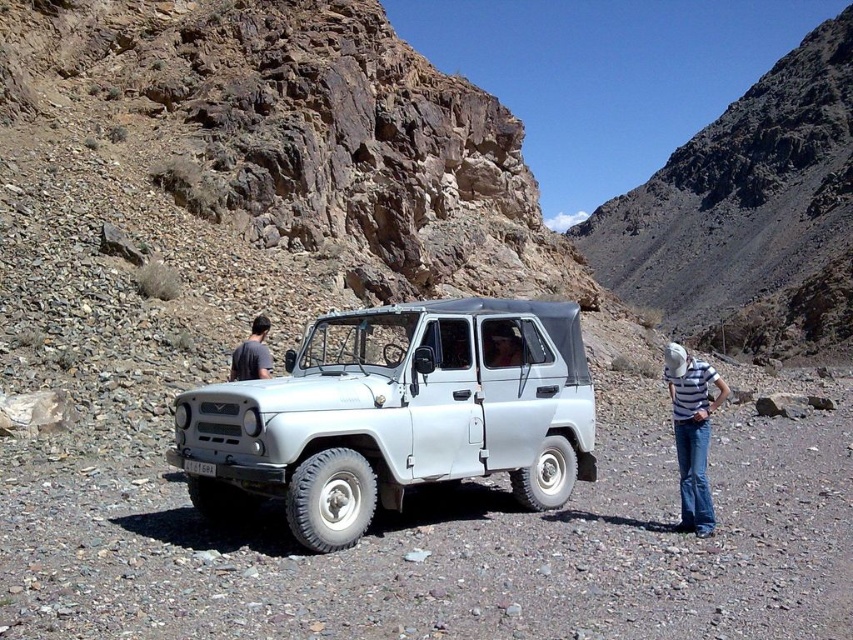
You are a photographer trying to capture both the matte gray vehicle at center and the gray cotton shirt at center in a single shot. Since the camera can only focus on objects within a specific size range, which object should you prioritize to ensure it fits properly in the frame?

The matte gray vehicle at center is smaller than the gray cotton shirt at center, so you should prioritize focusing on the gray cotton shirt at center to ensure it fits properly in the frame.

You are a photographer trying to capture a photo of the matte gray vehicle at center and the gray cotton shirt at center from the left side of the scene. Which object will appear on the left side in your photo?

The gray cotton shirt at center will appear on the left side of the photo because the matte gray vehicle at center is positioned to its right.

You are standing at the center of the image. Looking towards the silver off road vehicle parked on the rocky terrain, where exactly would you find the striped fabric shirt at lower right?

The striped fabric shirt at lower right is located at the coordinates point (692, 433).